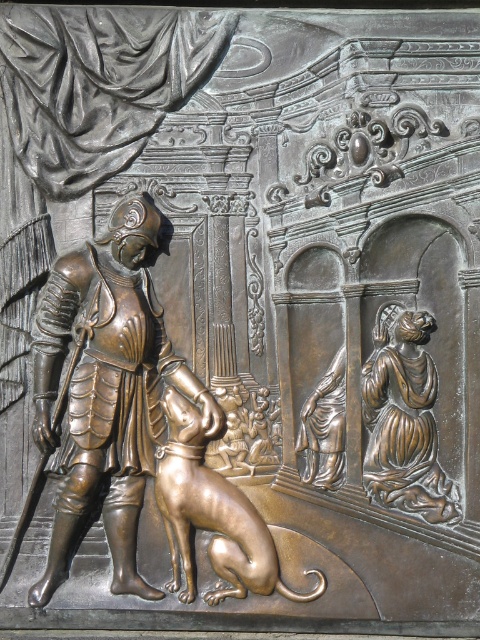
You are standing 1.74 meters away from the point at coordinates point (387, 433). If you want to take a photo of the relief sculpture, would you need to step back to ensure the entire artwork is in frame?

The point at coordinates point (387, 433) is 1.74 meters away from you. Since this point is part of the relief sculpture, stepping back might help capture the entire artwork in the photo.